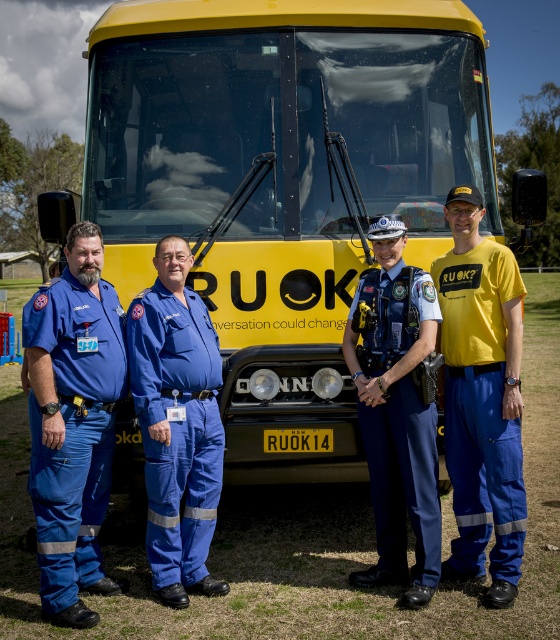
You are a photographer trying to capture a group photo of the blue cotton pants at left and the blue fabric jumpsuit at center. Since you want to ensure both subjects are in focus, you need to know which one is wider. Which one has a greater width?

The blue cotton pants at left has a greater width than the blue fabric jumpsuit at center.

You are an observer standing in front of the yellow bus. You notice two blue items of clothing. The first is the blue cotton pants at left, and the second is the blue fabric jumpsuit at center. Which of these two items is bigger in size?

The blue cotton pants at left is larger in size than the blue fabric jumpsuit at center.